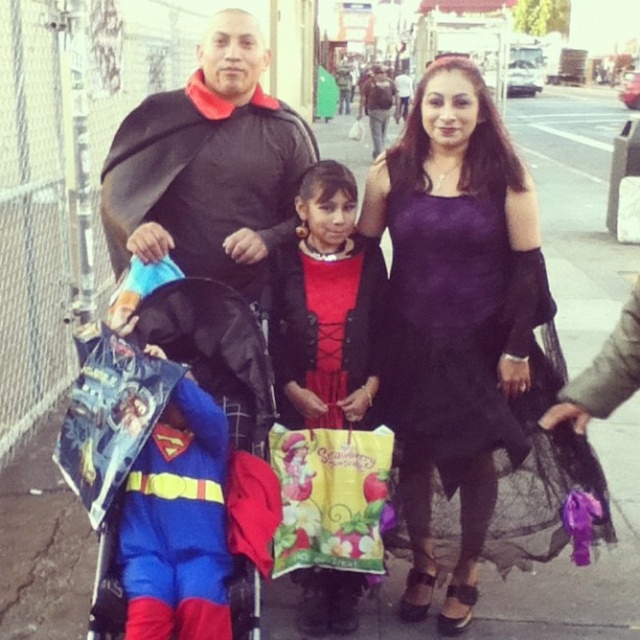
Which is more to the right, matte purple dress at center or black fabric baby carriage at center?

matte purple dress at center is more to the right.

Who is shorter, matte purple dress at center or black fabric baby carriage at center?

Standing shorter between the two is black fabric baby carriage at center.

Which is behind, point (305, 227) or point (244, 566)?

Point (305, 227)

The image size is (640, 640). In order to click on matte purple dress at center in this screenshot , I will do `click(326, 307)`.

Can you confirm if superman costume at center is positioned to the right of blue fabric superhero at lower left?

Correct, you'll find superman costume at center to the right of blue fabric superhero at lower left.

Is superman costume at center positioned at the back of blue fabric superhero at lower left?

No, superman costume at center is in front of blue fabric superhero at lower left.

Is point (216, 458) positioned behind point (141, 388)?

Yes, point (216, 458) is farther from viewer.

What are the coordinates of `superman costume at center` in the screenshot? It's located at (177, 524).

Is purple satin dress at center positioned at the back of black fabric baby carriage at center?

Yes.

Does purple satin dress at center have a lesser height compared to black fabric baby carriage at center?

No, purple satin dress at center is not shorter than black fabric baby carriage at center.

Find the location of a particular element. purple satin dress at center is located at coordinates (483, 384).